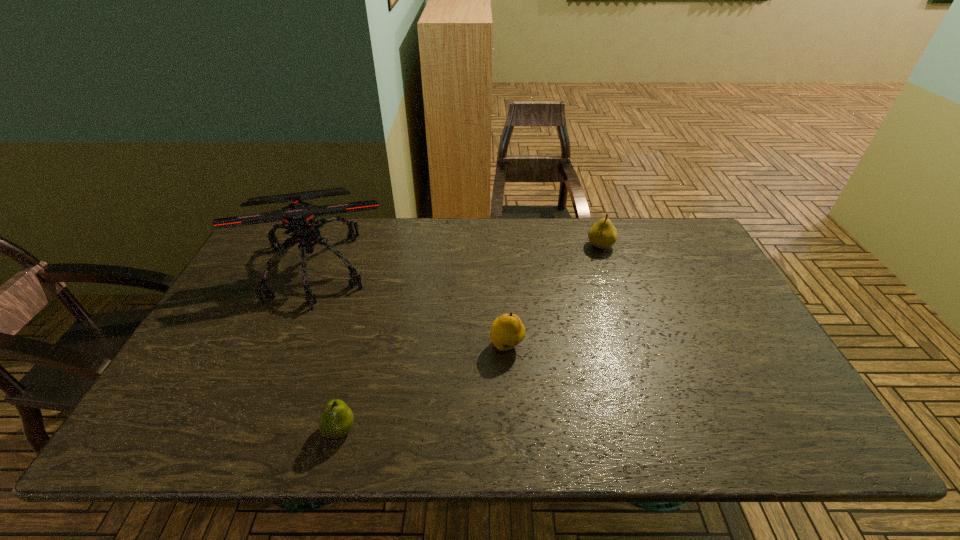
Locate an element on the screen. This screenshot has height=540, width=960. drone is located at coordinates (298, 217).

Find the location of a particular element. This screenshot has height=540, width=960. the farthest pear is located at coordinates (603, 234).

I want to click on the rightmost pear, so click(x=603, y=234).

Where is `the third farthest object`? This screenshot has height=540, width=960. the third farthest object is located at coordinates (507, 331).

This screenshot has height=540, width=960. In order to click on the third object from left to right in this screenshot , I will do `click(507, 331)`.

The height and width of the screenshot is (540, 960). I want to click on the nearest pear, so click(x=336, y=419).

Identify the location of the nearest object. (336, 419).

Image resolution: width=960 pixels, height=540 pixels. Find the location of `vacant space located on the right of the drone`. vacant space located on the right of the drone is located at coordinates (504, 267).

Identify the location of blank area located on the right of the rightmost pear. The height and width of the screenshot is (540, 960). (675, 246).

Where is `free spot located 0.190m on the right of the third object from left to right`? The height and width of the screenshot is (540, 960). free spot located 0.190m on the right of the third object from left to right is located at coordinates 598,346.